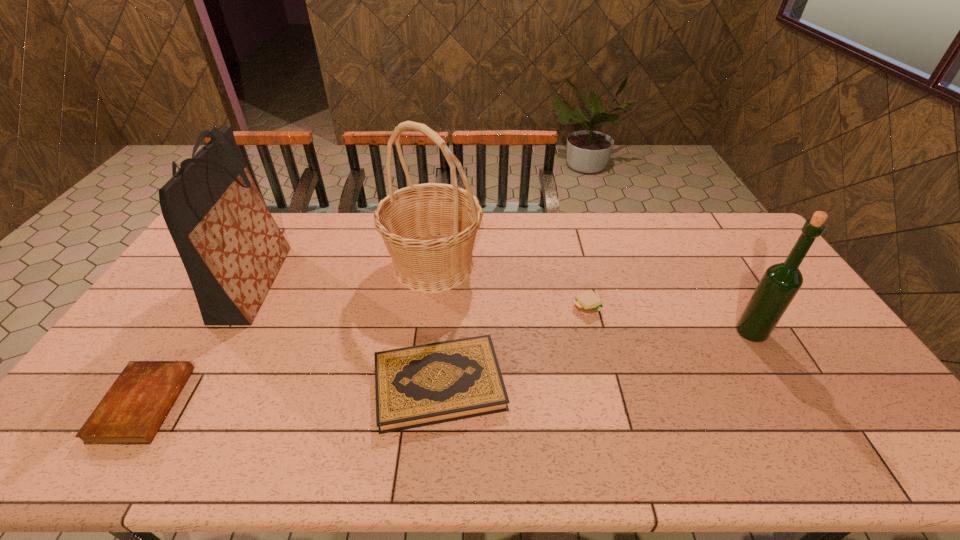
The height and width of the screenshot is (540, 960). I want to click on blank space located on the front of the patty, so click(607, 392).

This screenshot has height=540, width=960. Find the location of `vacant position located 0.180m on the back of the hardback book`. vacant position located 0.180m on the back of the hardback book is located at coordinates (446, 298).

Identify the location of vacant space located 0.200m on the spine side of the Bible. The height and width of the screenshot is (540, 960). (255, 404).

Find the location of a particular element. basket that is positioned at the far edge is located at coordinates (429, 229).

Identify the location of shopping bag that is at the far edge. This screenshot has width=960, height=540. (232, 249).

The height and width of the screenshot is (540, 960). Identify the location of hardback book positioned at the near edge. (428, 384).

The image size is (960, 540). Find the location of `Bible at the near edge`. Bible at the near edge is located at coordinates (131, 412).

Identify the location of object located at the left edge. (131, 412).

Locate an element on the screen. The height and width of the screenshot is (540, 960). object that is at the near left corner is located at coordinates point(131,412).

You are a GUI agent. You are given a task and a screenshot of the screen. Output one action in this format:
    pyautogui.click(x=<x>, y=<y>)
    Task: Click on the vacant space at the left edge
    The width and height of the screenshot is (960, 540).
    Given the screenshot: What is the action you would take?
    pyautogui.click(x=64, y=425)